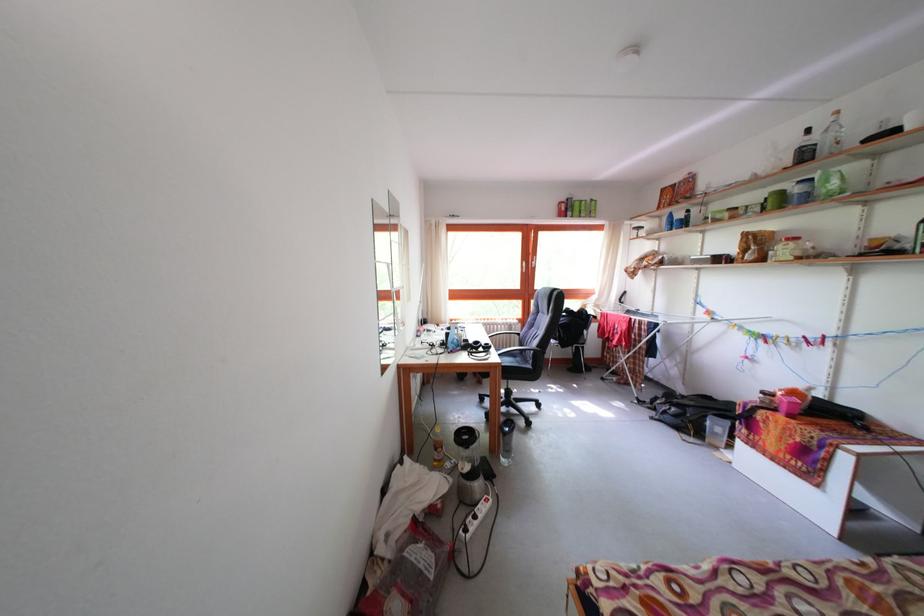
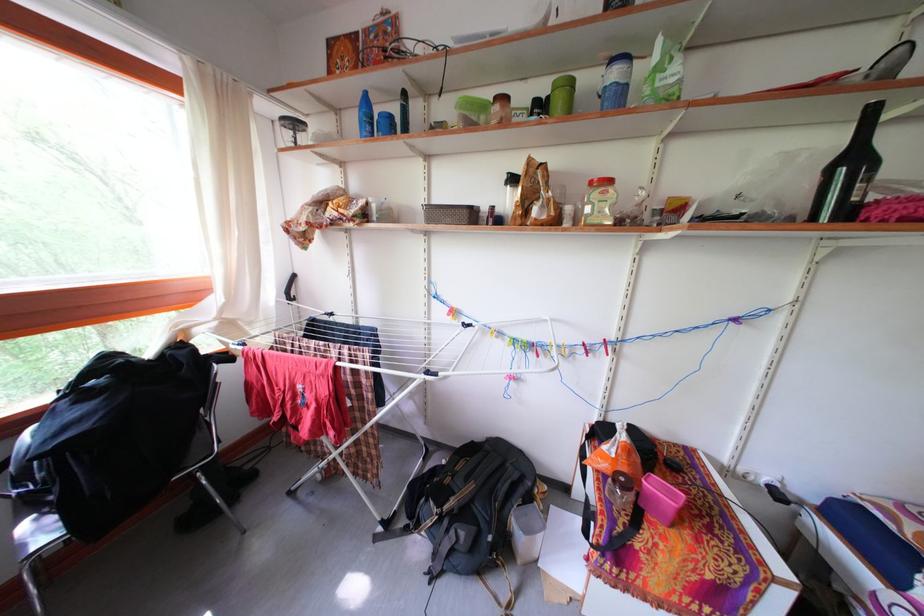
The point at (769, 347) is marked in the first image. Where is the corresponding point in the second image?

(540, 361)